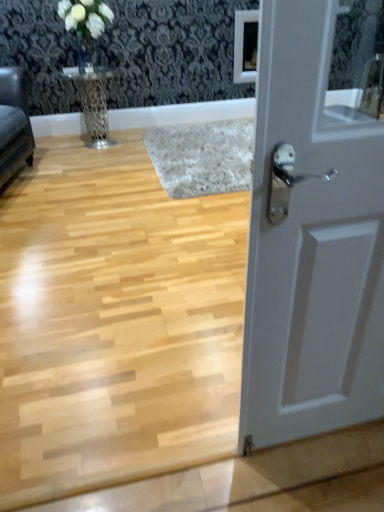
At what (x,y) coordinates should I click in order to perform the action: click on vacant space underneath metallic silver table at upper left (from a real-world perspective). Please return your answer as a coordinate pair (x, y). The width and height of the screenshot is (384, 512). Looking at the image, I should click on (94, 149).